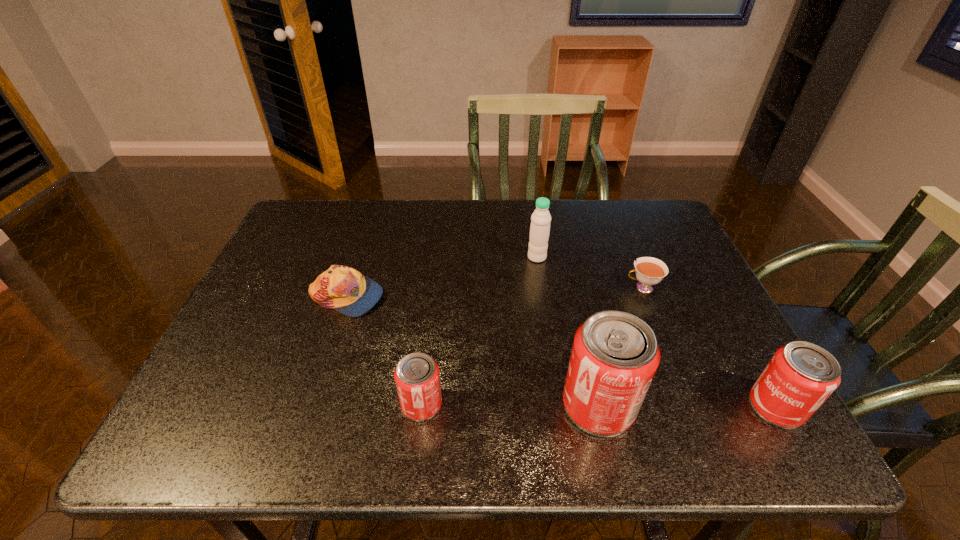
Identify the location of free space located 0.300m on the left of the rightmost can. (601, 407).

Locate an element on the screen. The width and height of the screenshot is (960, 540). free spot located on the back of the water bottle is located at coordinates (532, 225).

Identify the location of vacant space located on the side of the second object from right to left with the handle. The height and width of the screenshot is (540, 960). (597, 287).

Where is `blank area located on the side of the second object from right to left with the handle`? The height and width of the screenshot is (540, 960). blank area located on the side of the second object from right to left with the handle is located at coordinates pos(593,287).

Identify the location of vacant space located 0.070m on the side of the second object from right to left with the handle. Image resolution: width=960 pixels, height=540 pixels. (597, 287).

This screenshot has width=960, height=540. In order to click on vacant space located on the bill of the cap in this screenshot , I will do `click(478, 297)`.

Identify the location of object that is at the left edge. The height and width of the screenshot is (540, 960). (344, 289).

Locate an element on the screen. The image size is (960, 540). can that is positioned at the right edge is located at coordinates (800, 376).

You are a GUI agent. You are given a task and a screenshot of the screen. Output one action in this format:
    pyautogui.click(x=<x>, y=<y>)
    Task: Click on the teacup located at the right edge
    The width and height of the screenshot is (960, 540).
    Given the screenshot: What is the action you would take?
    pyautogui.click(x=649, y=271)

At what (x,y) coordinates should I click in order to perform the action: click on object situated at the near right corner. Please return your answer as a coordinate pair (x, y). The image size is (960, 540). Looking at the image, I should click on pyautogui.click(x=800, y=376).